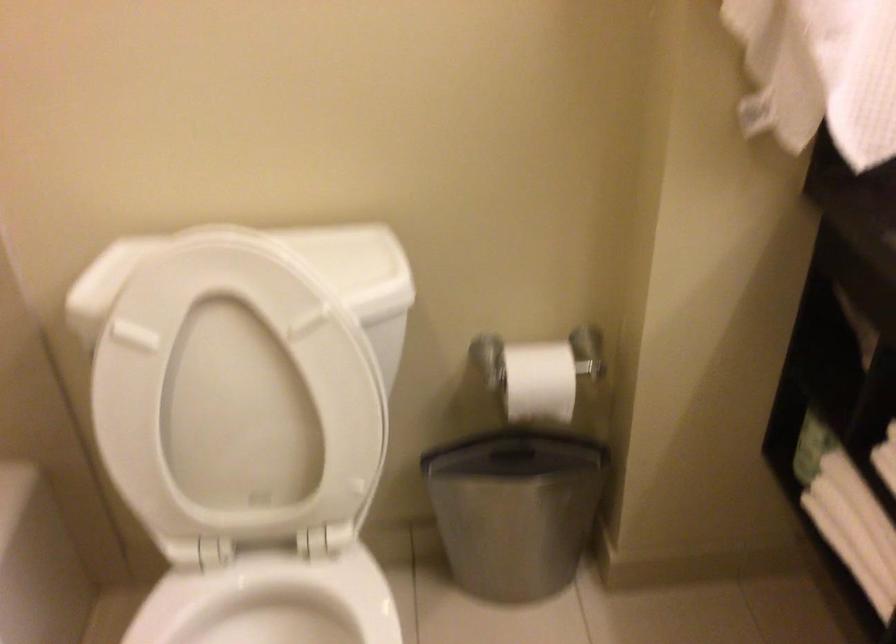
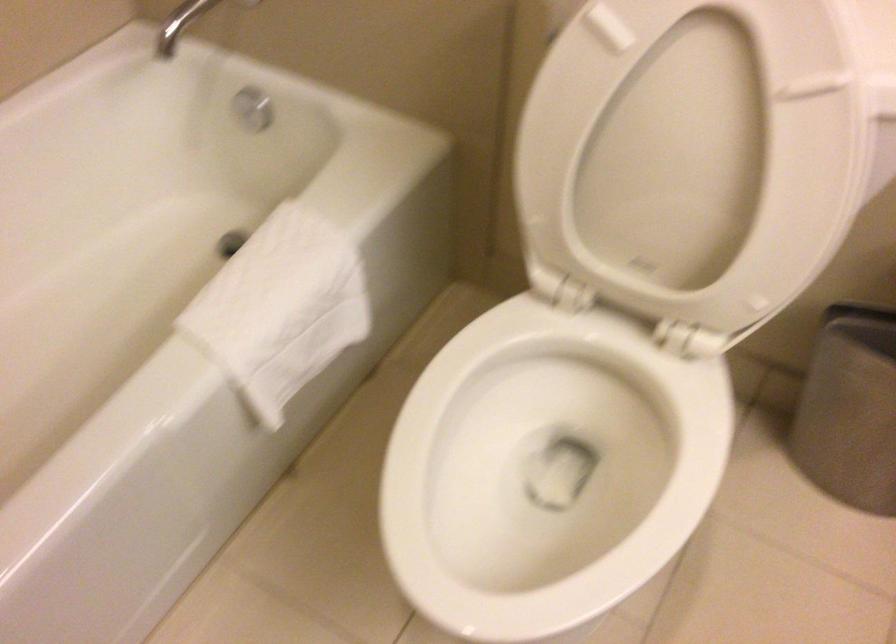
Locate, in the second image, the point that corresponds to (478,521) in the first image.

(858, 402)